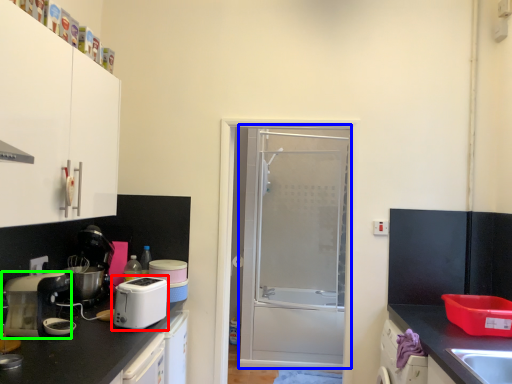
Question: Which is nearer to the kitchen appliance (highlighted by a red box)? screen door (highlighted by a blue box) or home appliance (highlighted by a green box).

Choices:
 (A) screen door
 (B) home appliance

Answer: (B)